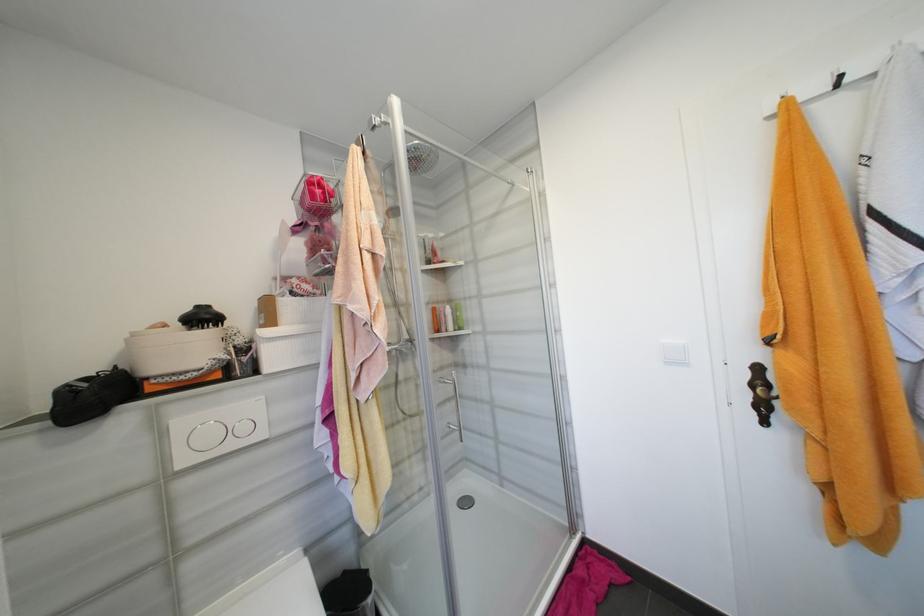
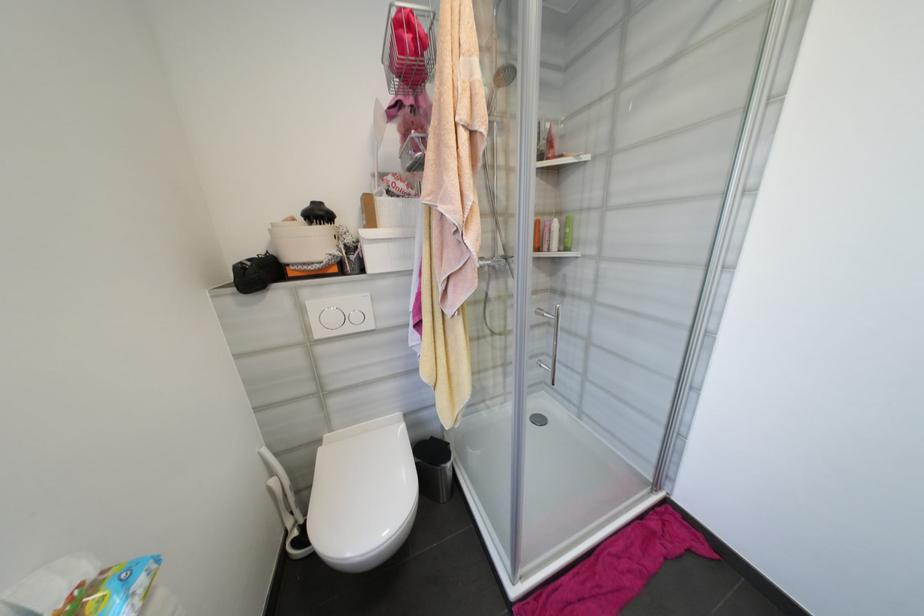
The point at (249, 429) is marked in the first image. Where is the corresponding point in the second image?

(361, 318)